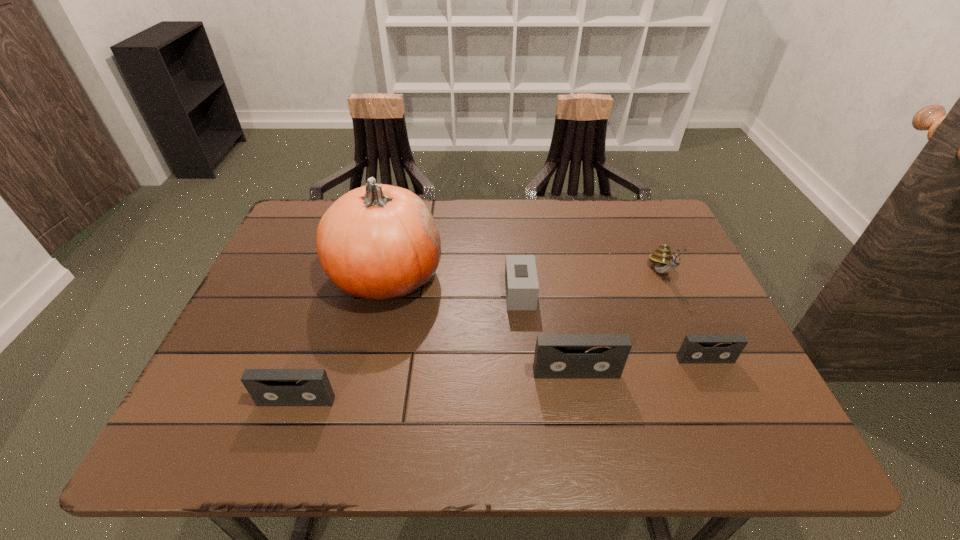
If we want them evenly spaced by inserting an extra videotape among them, please locate a free spot for this new videotape. Please provide its 2D coordinates. Your answer should be formatted as a tuple, i.e. [(x, y)], where the tuple contains the x and y coordinates of a point satisfying the conditions above.

[(440, 387)]